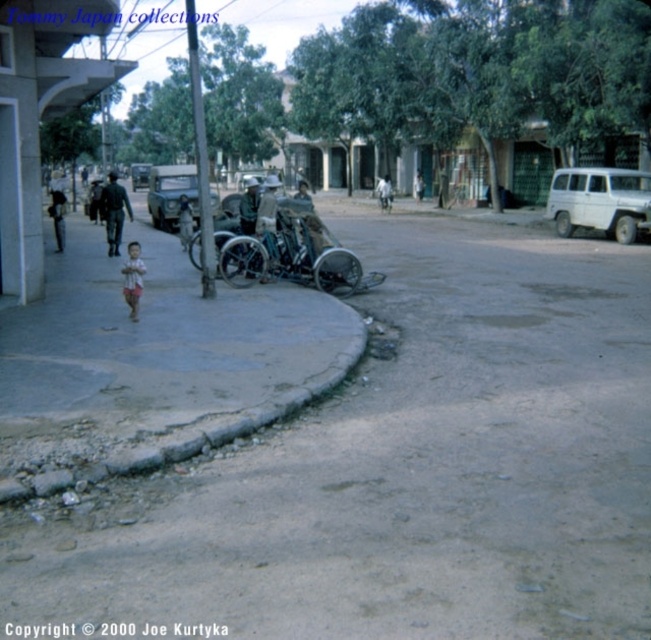
Question: Does gray concrete curb at lower left have a smaller size compared to matte black car at center?

Choices:
 (A) no
 (B) yes

Answer: (B)

Question: Which of the following is the farthest from the observer?

Choices:
 (A) shiny chrome motorcycle at center
 (B) matte black car at center

Answer: (A)

Question: Which of the following is the farthest from the observer?

Choices:
 (A) gray concrete curb at lower left
 (B) metallic silver car at center
 (C) striped shirt child at lower left
 (D) gray concrete pavement at lower left

Answer: (B)

Question: Is white matte van at right behind metallic silver car at center?

Choices:
 (A) yes
 (B) no

Answer: (B)

Question: Which object is positioned farthest from the gray concrete curb at lower left?

Choices:
 (A) white matte van at right
 (B) shiny chrome motorcycle at center
 (C) metallic silver car at center
 (D) matte black car at center

Answer: (C)

Question: Can you confirm if gray concrete curb at lower left is positioned above matte black car at center?

Choices:
 (A) no
 (B) yes

Answer: (A)